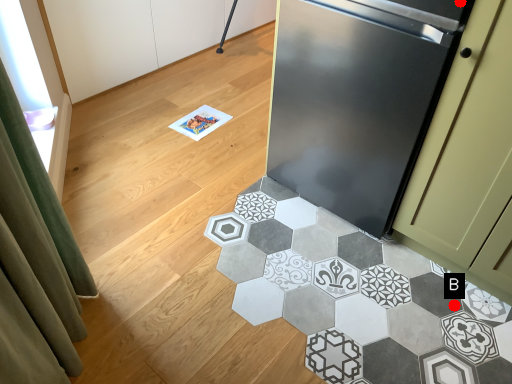
Question: Two points are circled on the image, labeled by A and B beside each circle. Which point is further to the camera?

Choices:
 (A) A is further
 (B) B is further

Answer: (B)